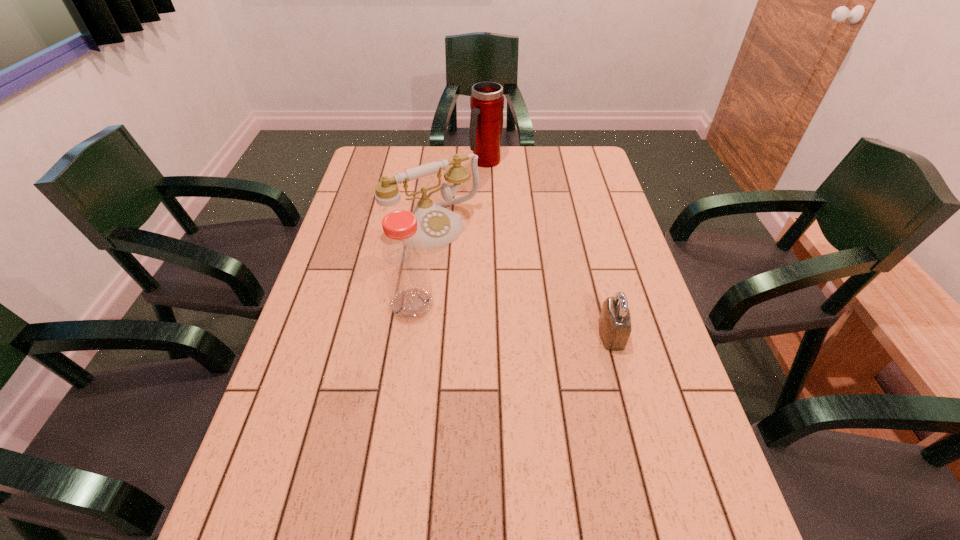
Where is `object that stands as the closest to the bottle`? The height and width of the screenshot is (540, 960). object that stands as the closest to the bottle is located at coordinates (438, 226).

At what (x,y) coordinates should I click in order to perform the action: click on object that is the nearest to the bottle. Please return your answer as a coordinate pair (x, y). The image size is (960, 540). Looking at the image, I should click on pos(438,226).

Identify the location of free spot that satisfies the following two spatial constraints: 1. on the front side of the bottle; 2. at the front of the rightmost object near the keyhole. The height and width of the screenshot is (540, 960). (408, 334).

Where is `free space that satisfies the following two spatial constraints: 1. on the front side of the bottle; 2. at the front of the rightmost object near the keyhole`? Image resolution: width=960 pixels, height=540 pixels. free space that satisfies the following two spatial constraints: 1. on the front side of the bottle; 2. at the front of the rightmost object near the keyhole is located at coordinates (408, 334).

Identify the location of vacant space that satisfies the following two spatial constraints: 1. on the front side of the shortest object; 2. at the front of the second farthest object near the keyhole. The image size is (960, 540). [x=420, y=334].

You are a GUI agent. You are given a task and a screenshot of the screen. Output one action in this format:
    pyautogui.click(x=<x>, y=<y>)
    Task: Click on the vacant space that satisfies the following two spatial constraints: 1. on the back side of the bottle; 2. on the right side of the third nearest object
    
    Given the screenshot: What is the action you would take?
    pyautogui.click(x=423, y=226)

Locate an element on the screen. vacant space that satisfies the following two spatial constraints: 1. on the front side of the bottle; 2. at the front of the shortest object near the keyhole is located at coordinates (408, 334).

Find the location of `free space that satisfies the following two spatial constraints: 1. on the front side of the farthest object; 2. at the front of the shortest object near the keyhole`. free space that satisfies the following two spatial constraints: 1. on the front side of the farthest object; 2. at the front of the shortest object near the keyhole is located at coordinates (490, 334).

Where is `vacant space that satisfies the following two spatial constraints: 1. on the front side of the padlock; 2. at the front of the bottle near the keyhole`? vacant space that satisfies the following two spatial constraints: 1. on the front side of the padlock; 2. at the front of the bottle near the keyhole is located at coordinates (408, 334).